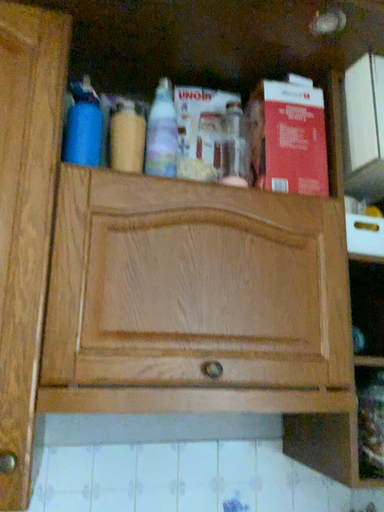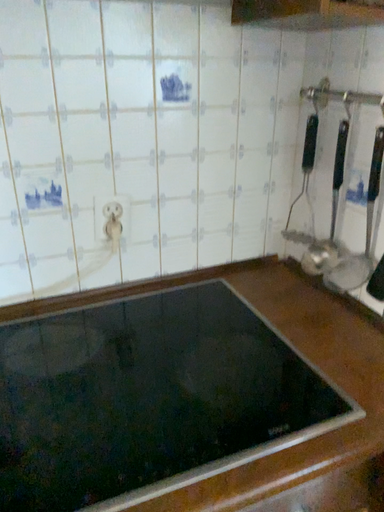
Question: How did the camera likely rotate when shooting the video?

Choices:
 (A) rotated right
 (B) rotated left

Answer: (A)